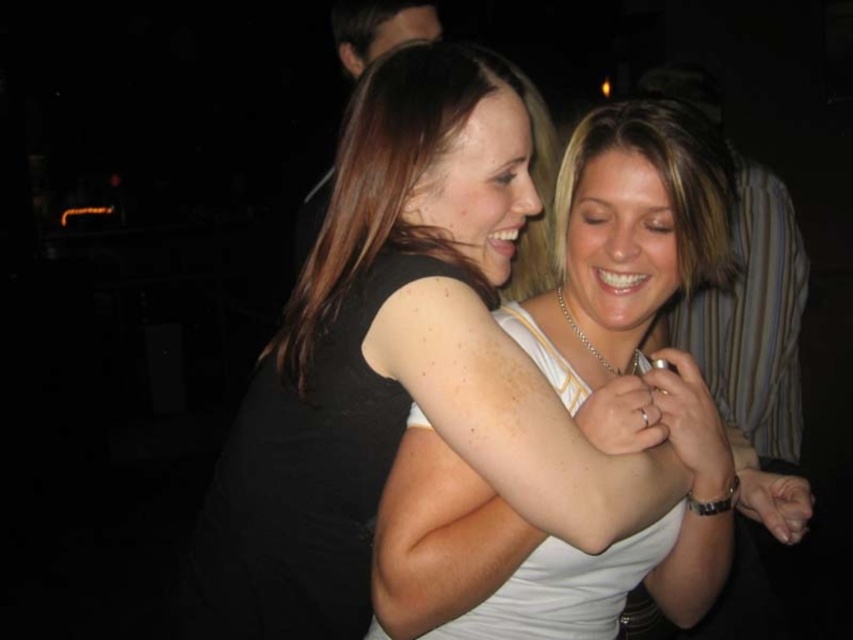
You are a photographer at a party and want to take a picture of the two people in the scene. The camera you are using has a focus point at coordinates 0.609, 0.700. Which object should you focus on to ensure the white tank top at center is in focus?

The white tank top at center is located at point (596, 388), so focusing on that coordinate will ensure the white tank top at center is in focus.

You are a photographer standing in the room and want to take a closeup photo of the white tank top at center. The camera you have can focus on objects within 30 inches. Can you take the photo without moving closer?

The distance between the white tank top at center and the viewer is 33.26 inches, which is beyond the camera focus range of 30 inches. Therefore, you need to move closer to take the photo.